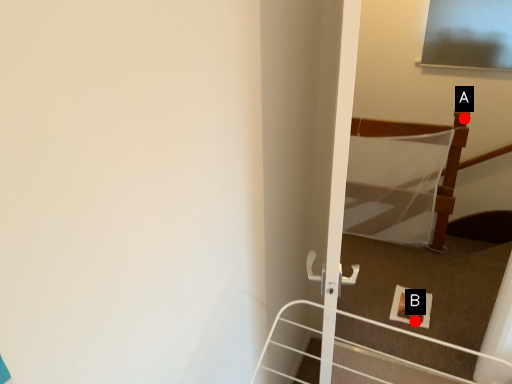
Question: Two points are circled on the image, labeled by A and B beside each circle. Which point is closer to the camera?

Choices:
 (A) A is closer
 (B) B is closer

Answer: (B)